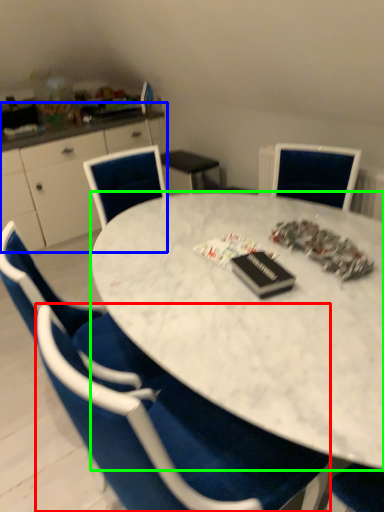
Question: Estimate the real-world distances between objects in this image. Which object is closer to chair (highlighted by a red box), computer desk (highlighted by a blue box) or desk (highlighted by a green box)?

Choices:
 (A) computer desk
 (B) desk

Answer: (B)